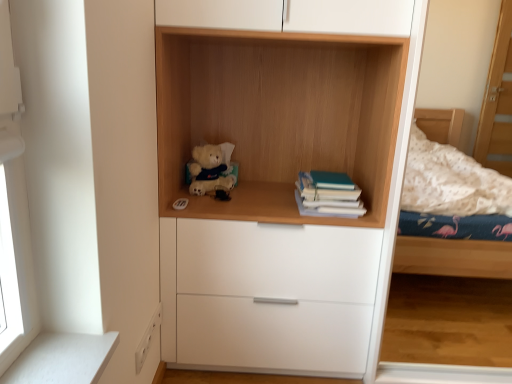
Find the location of `soft plush teddy bear at center`. soft plush teddy bear at center is located at coordinates (211, 169).

This screenshot has height=384, width=512. I want to click on teddy bear located behind the wooden shelf at center, so click(211, 169).

Is soft plush teddy bear at center at the back of wooden shelf at center?

Yes.

Is wooden shelf at center behind soft plush teddy bear at center?

No.

Can we say wooden shelf at center lies outside soft plush teddy bear at center?

That's correct, wooden shelf at center is outside of soft plush teddy bear at center.

Is point (165, 357) behind point (173, 33)?

Yes, it is.

Does white matte chest of drawers at center turn towards wooden shelf at center?

No, white matte chest of drawers at center is not turned towards wooden shelf at center.

Consider the image. Between white matte chest of drawers at center and wooden shelf at center, which one has more height?

Standing taller between the two is white matte chest of drawers at center.

From the image's perspective, which is below, teal matte book at right or white matte chest of drawers at center?

white matte chest of drawers at center appears lower in the image.

Is teal matte book at right touching white matte chest of drawers at center?

teal matte book at right and white matte chest of drawers at center are not in contact.

Consider the image. Could white matte chest of drawers at center be considered to be inside teal matte book at right?

That's incorrect, white matte chest of drawers at center is not inside teal matte book at right.

Which is more distant, [333,185] or [233,235]?

Positioned behind is point [333,185].

Is wooden shelf at center far from teal matte book at right?

They are positioned close to each other.

Which object is further away from the camera taking this photo, wooden shelf at center or teal matte book at right?

Positioned behind is teal matte book at right.

From a real-world perspective, which is physically below, wooden shelf at center or teal matte book at right?

teal matte book at right.

Considering the relative sizes of wooden shelf at center and teal matte book at right in the image provided, is wooden shelf at center wider than teal matte book at right?

Indeed, wooden shelf at center has a greater width compared to teal matte book at right.

Looking at the image, does white matte chest of drawers at center seem bigger or smaller compared to soft plush teddy bear at center?

Clearly, white matte chest of drawers at center is larger in size than soft plush teddy bear at center.

Is white matte chest of drawers at center to the right of soft plush teddy bear at center from the viewer's perspective?

Yes, white matte chest of drawers at center is to the right of soft plush teddy bear at center.

Would you say white matte chest of drawers at center is inside or outside soft plush teddy bear at center?

white matte chest of drawers at center is not enclosed by soft plush teddy bear at center.

Is white matte chest of drawers at center positioned far away from soft plush teddy bear at center?

They are positioned close to each other.

Which of these two, soft plush teddy bear at center or wooden shelf at center, is thinner?

soft plush teddy bear at center.

Is soft plush teddy bear at center to the right of wooden shelf at center from the viewer's perspective?

No, soft plush teddy bear at center is not to the right of wooden shelf at center.

In the scene shown: Is soft plush teddy bear at center taller or shorter than wooden shelf at center?

Considering their sizes, soft plush teddy bear at center has less height than wooden shelf at center.

From a real-world perspective, is soft plush teddy bear at center under wooden shelf at center?

Correct, in the physical world, soft plush teddy bear at center is lower than wooden shelf at center.

Is teal matte book at right positioned with its back to soft plush teddy bear at center?

No, teal matte book at right is not facing the opposite direction of soft plush teddy bear at center.

What are the coordinates of `paperback book that is on the right side of soft plush teddy bear at center` in the screenshot? It's located at (329, 194).

Is teal matte book at right wider than soft plush teddy bear at center?

Yes, teal matte book at right is wider than soft plush teddy bear at center.

Where is `shelf that appears above the soft plush teddy bear at center (from a real-world perspective)`? shelf that appears above the soft plush teddy bear at center (from a real-world perspective) is located at coordinates (278, 116).

Identify the location of chest of drawers that is on the left side of wooden shelf at center. (267, 296).

Estimate the real-world distances between objects in this image. Which object is closer to soft plush teddy bear at center, wooden shelf at center or white matte chest of drawers at center?

wooden shelf at center lies closer to soft plush teddy bear at center than the other object.

Based on the photo, based on their spatial positions, is wooden shelf at center or soft plush teddy bear at center further from white matte chest of drawers at center?

Among the two, soft plush teddy bear at center is located further to white matte chest of drawers at center.

Based on their spatial positions, is soft plush teddy bear at center or teal matte book at right closer to wooden shelf at center?

The object closer to wooden shelf at center is teal matte book at right.

From the image, which object appears to be farther from white matte chest of drawers at center, soft plush teddy bear at center or teal matte book at right?

The object further to white matte chest of drawers at center is soft plush teddy bear at center.

From the image, which object appears to be farther from teal matte book at right, white matte chest of drawers at center or wooden shelf at center?

Among the two, wooden shelf at center is located further to teal matte book at right.

Consider the image. From the image, which object appears to be nearer to white matte chest of drawers at center, wooden shelf at center or teal matte book at right?

teal matte book at right is positioned closer to the anchor white matte chest of drawers at center.

When comparing their distances from teal matte book at right, does wooden shelf at center or white matte chest of drawers at center seem further?

wooden shelf at center is positioned further to the anchor teal matte book at right.

Which object lies further to the anchor point soft plush teddy bear at center, wooden shelf at center or teal matte book at right?

Based on the image, teal matte book at right appears to be further to soft plush teddy bear at center.

The height and width of the screenshot is (384, 512). I want to click on teddy bear between wooden shelf at center and white matte chest of drawers at center vertically, so click(211, 169).

The height and width of the screenshot is (384, 512). What are the coordinates of `shelf between soft plush teddy bear at center and teal matte book at right in the horizontal direction` in the screenshot? It's located at (278, 116).

Locate an element on the screen. paperback book between wooden shelf at center and white matte chest of drawers at center in the up-down direction is located at coordinates (329, 194).

Image resolution: width=512 pixels, height=384 pixels. Find the location of `chest of drawers between soft plush teddy bear at center and teal matte book at right from left to right`. chest of drawers between soft plush teddy bear at center and teal matte book at right from left to right is located at coordinates (267, 296).